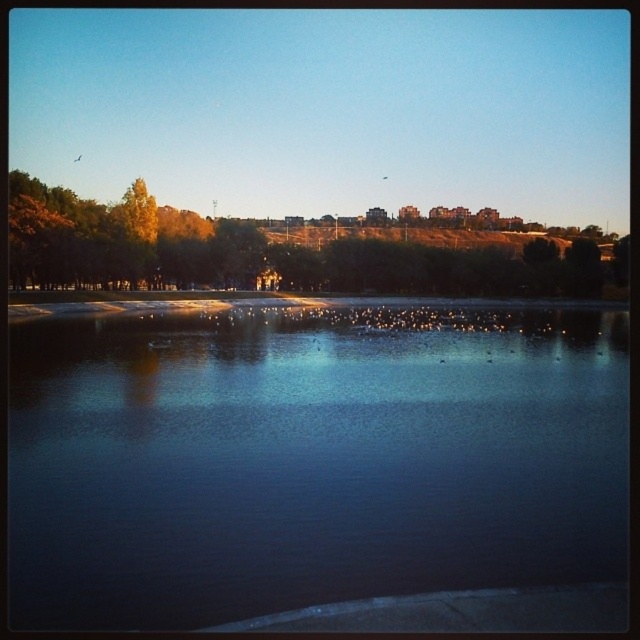
Question: Does dark reflective water at center appear on the right side of green leafy trees at upper center?

Choices:
 (A) yes
 (B) no

Answer: (B)

Question: Which of the following is the farthest from the observer?

Choices:
 (A) dark reflective water at center
 (B) green leafy trees at upper center

Answer: (B)

Question: Does dark reflective water at center lie in front of green leafy trees at upper center?

Choices:
 (A) no
 (B) yes

Answer: (B)

Question: Does dark reflective water at center have a smaller size compared to green leafy trees at upper center?

Choices:
 (A) no
 (B) yes

Answer: (B)

Question: Which point is closer to the camera taking this photo?

Choices:
 (A) (248, 221)
 (B) (328, 378)

Answer: (B)